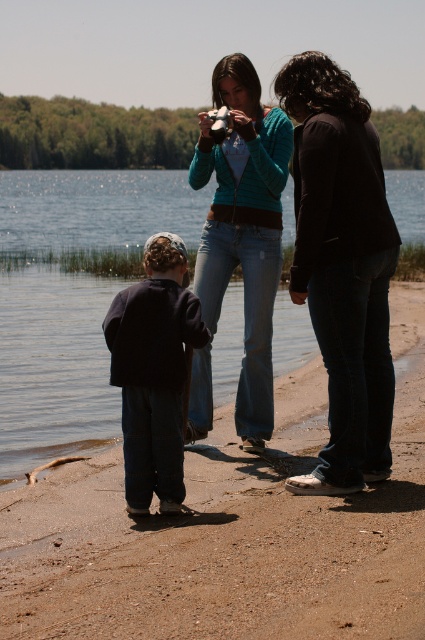
You are standing at the point marked as point (x=342, y=268). What is the color of the clothing item directly beneath you?

The point (x=342, y=268) is on black matte pants at right, so the color of the clothing item directly beneath you is black.

You are a photographer positioned at the center of the image. You need to frame a shot that includes both the young child dressed in a dark jacket and jeans and the black matte pants at right. Based on their positions, where should you position your camera to ensure both subjects are in the frame?

The black matte pants at right are located at point (342, 268). To include both the young child and the black matte pants at right in the frame, position the camera centrally between their coordinates, ensuring both are within the camera view.